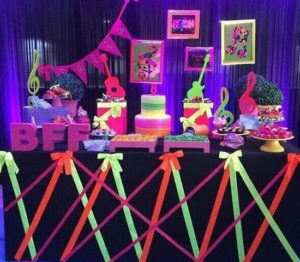
At what (x,y) coordinates should I click in order to perform the action: click on ribbon. Please return your answer as a coordinate pair (x, y). Looking at the image, I should click on (170, 154).